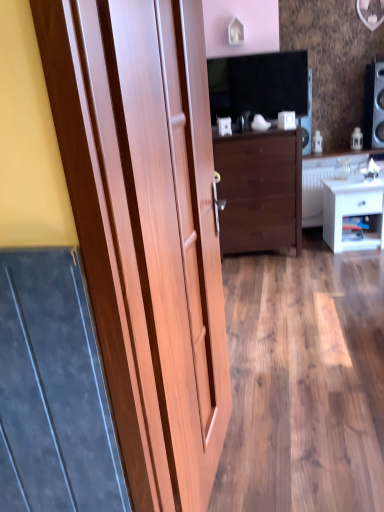
Image resolution: width=384 pixels, height=512 pixels. What are the coordinates of `vacant space to the right of wooden door at left` in the screenshot? It's located at (297, 448).